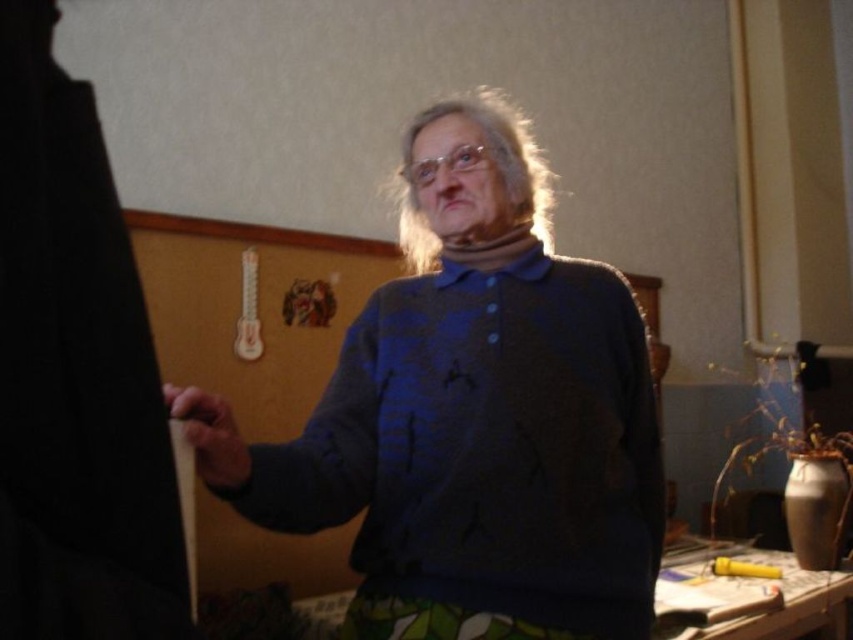
Is blue knitted sweater at center taller than smooth wooden pencil at left?

Correct, blue knitted sweater at center is much taller as smooth wooden pencil at left.

Which of these two, blue knitted sweater at center or smooth wooden pencil at left, stands taller?

blue knitted sweater at center is taller.

Which is in front, point (622, 419) or point (209, 397)?

Point (209, 397) is more forward.

The height and width of the screenshot is (640, 853). I want to click on blue knitted sweater at center, so pos(482,413).